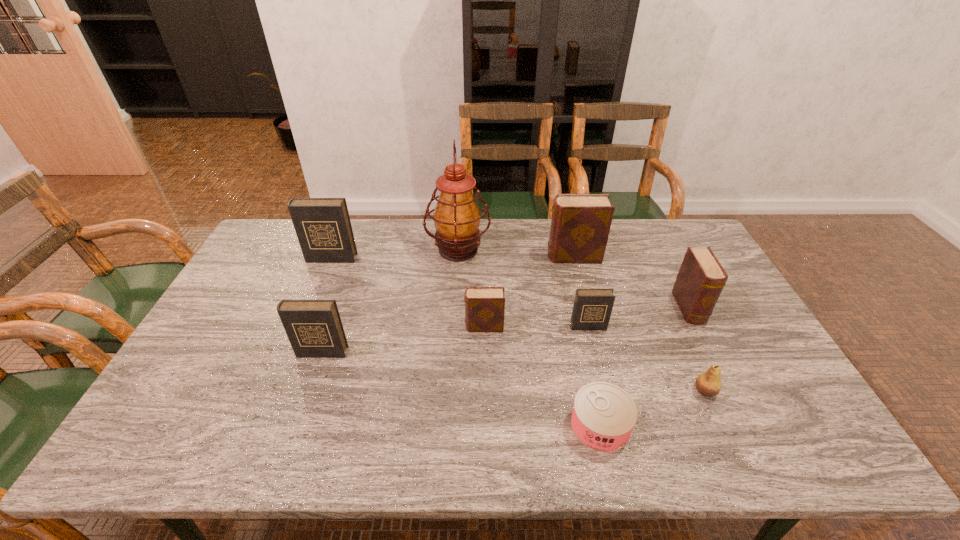
Where is `oil lamp`? This screenshot has height=540, width=960. oil lamp is located at coordinates (456, 217).

Identify the location of the second brown diary from right to left. (580, 225).

Locate an element on the screen. This screenshot has width=960, height=540. the farthest brown diary is located at coordinates click(580, 225).

Where is `the farthest dark diary`? The image size is (960, 540). the farthest dark diary is located at coordinates (323, 227).

Identify the location of the rightmost diary. The height and width of the screenshot is (540, 960). (701, 278).

Locate an element on the screen. the rightmost brown diary is located at coordinates pos(701,278).

The width and height of the screenshot is (960, 540). I want to click on the nearest dark diary, so click(314, 328).

What are the coordinates of `the third nearest object` in the screenshot? It's located at (314, 328).

I want to click on the rightmost dark diary, so click(x=592, y=308).

What are the coordinates of `the second nearest dark diary` in the screenshot? It's located at (592, 308).